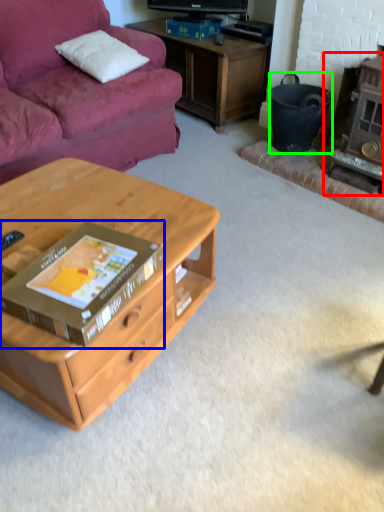
Question: Considering the real-world distances, which object is closest to fireplace (highlighted by a red box)? box (highlighted by a blue box) or trash bin/can (highlighted by a green box).

Choices:
 (A) box
 (B) trash bin/can

Answer: (B)